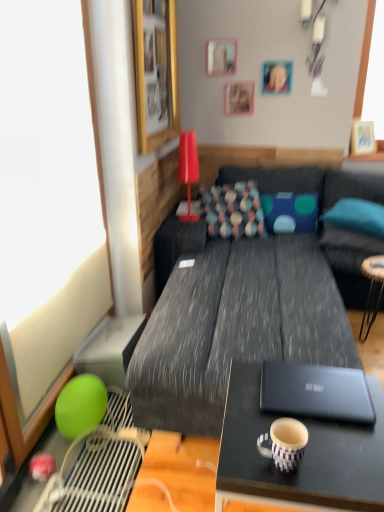
In order to click on empty space that is ontop of black matte laptop at center (from a real-world perspective) in this screenshot , I will do `click(318, 384)`.